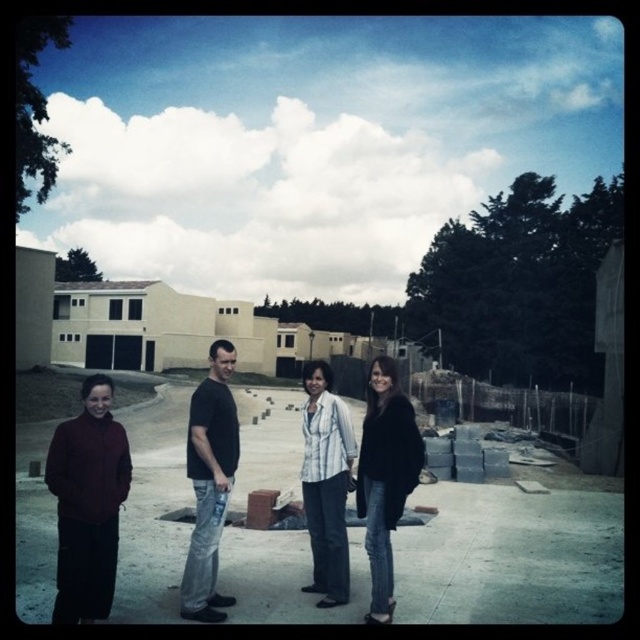
Identify the location of black fuzzy coat at center. Image resolution: width=640 pixels, height=640 pixels. (385, 477).

Which is above, brick wall at center or maroon fleece jacket at lower left?

maroon fleece jacket at lower left

Consider the image. Does brick wall at center appear on the right side of maroon fleece jacket at lower left?

Indeed, brick wall at center is positioned on the right side of maroon fleece jacket at lower left.

Looking at this image, who is more forward, (230, 552) or (97, 480)?

Point (97, 480) is in front.

I want to click on brick wall at center, so click(x=513, y=554).

Can you confirm if brick wall at center is positioned below black cotton t-shirt at center?

Yes, brick wall at center is below black cotton t-shirt at center.

Between brick wall at center and black cotton t-shirt at center, which one appears on the right side from the viewer's perspective?

Positioned to the right is brick wall at center.

Between point (467, 557) and point (189, 561), which one is positioned in front?

Positioned in front is point (189, 561).

At what (x,y) coordinates should I click in order to perform the action: click on brick wall at center. Please return your answer as a coordinate pair (x, y). The height and width of the screenshot is (640, 640). Looking at the image, I should click on (513, 554).